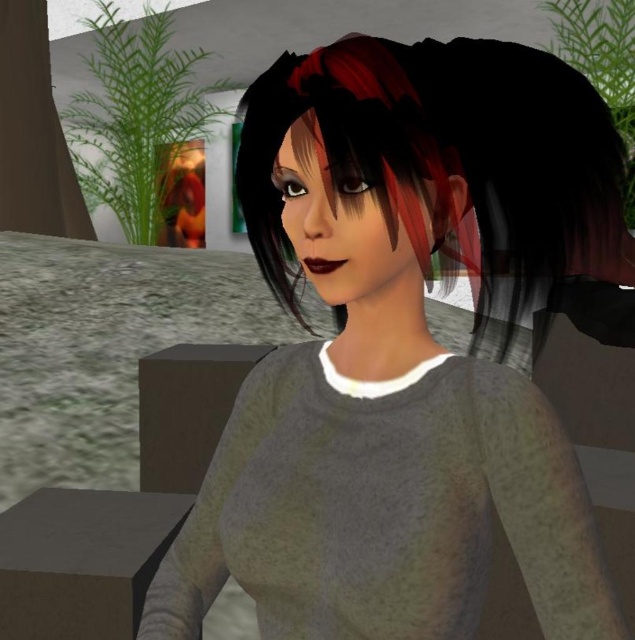
You are a fashion designer who needs to create a pattern for a new garment. You observe the gray matte sweater at center and the shiny black hair at center in the image. Which object would require a larger piece of fabric to cover its area?

The shiny black hair at center requires a larger piece of fabric since it occupies more space than the gray matte sweater at center.

You are a fashion designer who wants to create a new outfit for the character in the image. Given that the matte gray sweater at center is in front of the shiny black hair at center, which object should you focus on modifying first to ensure proper visibility of both the sweater and the hair?

The matte gray sweater at center should be modified first since it is currently in front of the shiny black hair at center, so adjusting its position or design will allow both the sweater and the hair to be visible properly.

You are a fashion designer who wants to place a scarf exactly 60 centimeters away from the viewer in the scene. The gray matte sweater at center is already positioned there. Can you place the scarf in a different location while keeping it visible in the scene?

The gray matte sweater at center is already positioned 60.19 centimeters from the viewer, so placing the scarf in a different location while keeping it visible would require placing it either closer than 60.19 cm or further away but still within the scene.